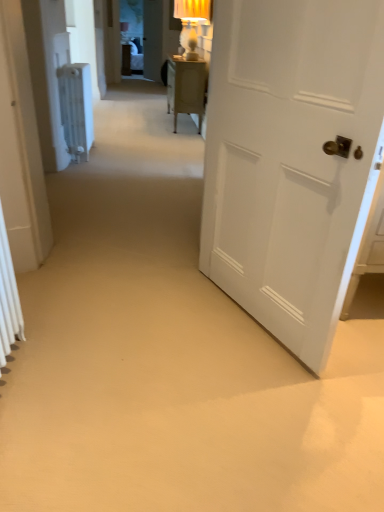
Locate an element on the screen. The image size is (384, 512). free point below white plastic radiator at left (from a real-world perspective) is located at coordinates (94, 151).